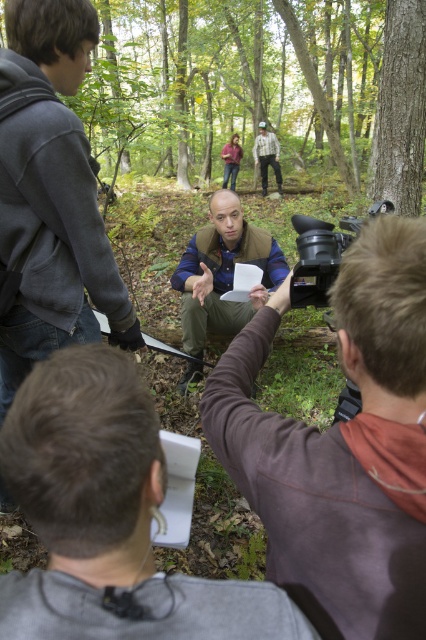
Based on the photo, you are a camera operator in the forest scene. You need to adjust the camera to focus on the point at coordinates point [388,211] and point [281,184]. Which point should you focus on first to ensure the foreground subject is in focus?

Point [388,211] is in front of point [281,184], so you should focus on point [388,211] first to ensure the foreground subject is in focus.

You are a director on a film set in the forest. You want to ensure the camera captures both the green leafy forest at upper center and the smooth bark tree at upper right in the frame. Based on their positions, which object should you focus on first to include both in the shot?

The green leafy forest at upper center is positioned over the smooth bark tree at upper right, so focusing on the green leafy forest at upper center first will naturally include the smooth bark tree at upper right in the shot below it.

You are an actor in a forest scene. You need to move from your current position near the dark gray hoodie at left to the green leafy forest at upper center. Which direction should you move to reach there?

To reach the green leafy forest at upper center from the dark gray hoodie at left, you should move to the right since the green leafy forest at upper center is located to the right of the dark gray hoodie at left.